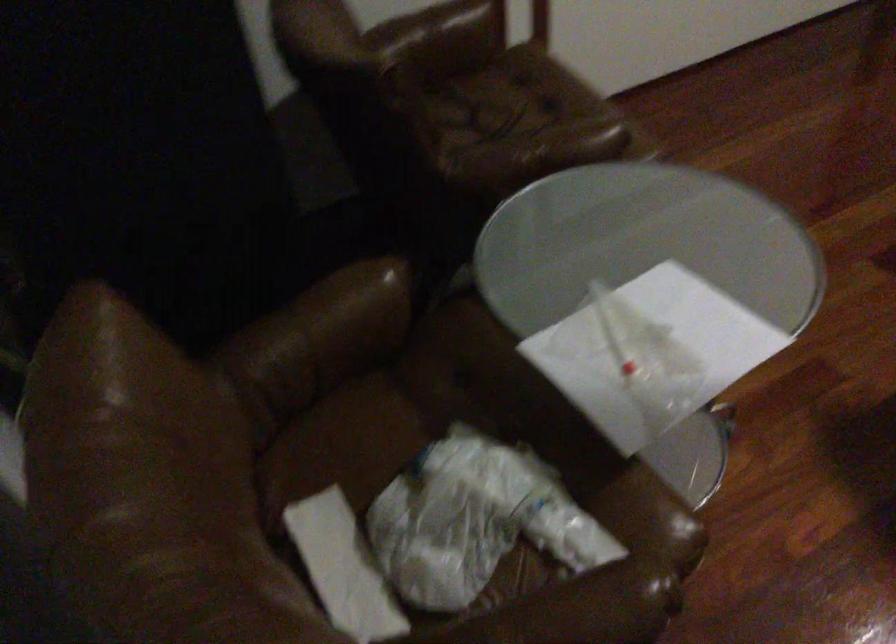
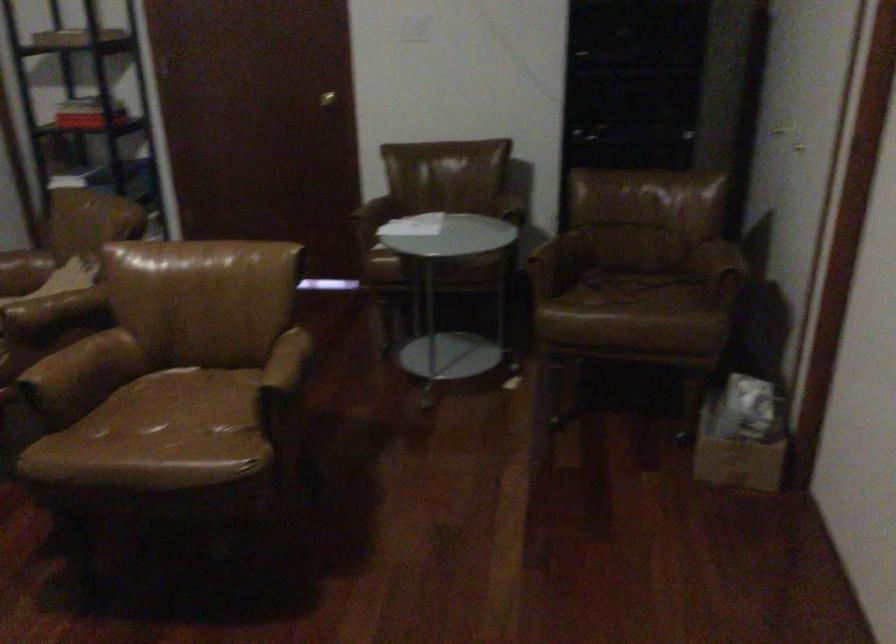
Question: I am providing you with two images of the same scene from different viewpoints. Please identify which objects are invisible in image2.

Choices:
 (A) chair armrest
 (B) cardboard box
 (C) brown chair sitting surface
 (D) none of these

Answer: (D)